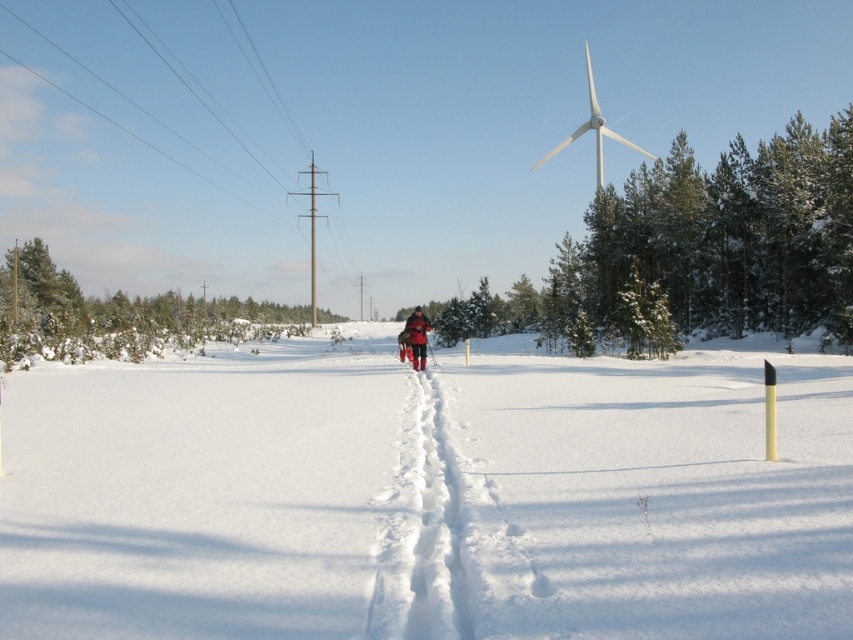
Question: Which is nearer to the gray metallic windmill at center?

Choices:
 (A) white powdery snow at center
 (B) red fabric jacket at center

Answer: (A)

Question: Does white powdery snow at center lie behind white fluffy snow trail at center?

Choices:
 (A) yes
 (B) no

Answer: (B)

Question: Can you confirm if white fluffy snow trail at center is positioned to the right of gray metallic windmill at center?

Choices:
 (A) no
 (B) yes

Answer: (B)

Question: Which of the following is the closest to the observer?

Choices:
 (A) (424, 346)
 (B) (451, 528)
 (C) (331, 192)

Answer: (B)

Question: Which point is closer to the camera?

Choices:
 (A) white powdery snow at center
 (B) white fluffy snow trail at center
 (C) red fabric jacket at center
 (D) gray metallic windmill at center

Answer: (A)

Question: Can you confirm if white powdery snow at center is positioned above white fluffy snow trail at center?

Choices:
 (A) no
 (B) yes

Answer: (A)